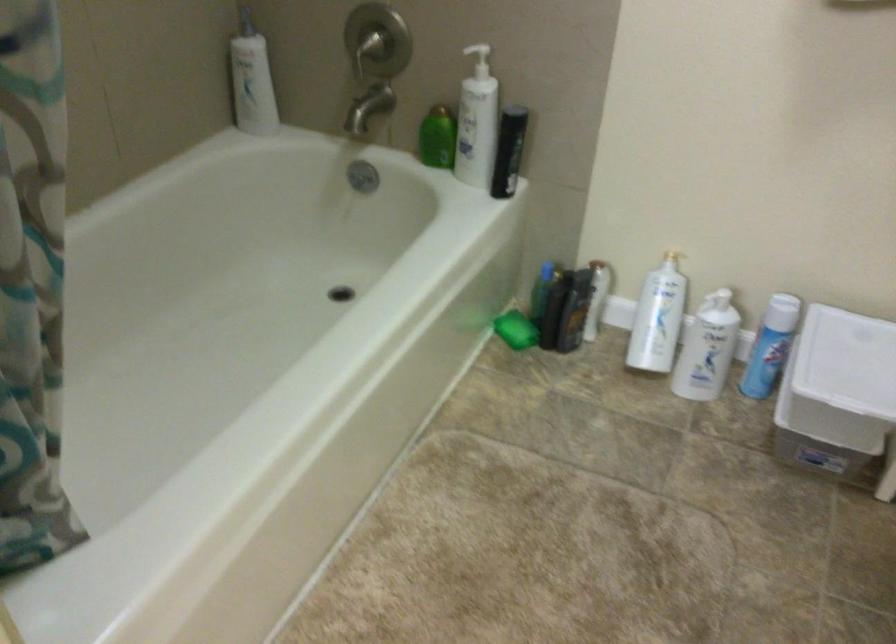
Where is `white plastic lid`? white plastic lid is located at coordinates (847, 361).